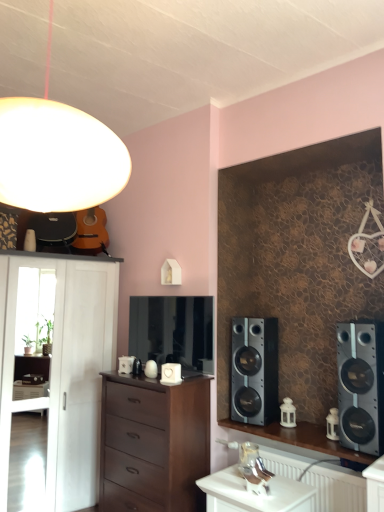
Question: Is matte white globe at upper left at the left side of satin silver speaker at right, placed as the first speaker when sorted from back to front?

Choices:
 (A) no
 (B) yes

Answer: (B)

Question: Is matte white globe at upper left facing towards satin silver speaker at right, acting as the second speaker starting from the right?

Choices:
 (A) no
 (B) yes

Answer: (A)

Question: Can you confirm if matte white globe at upper left is shorter than satin silver speaker at right, acting as the second speaker starting from the right?

Choices:
 (A) no
 (B) yes

Answer: (A)

Question: Is matte white globe at upper left wider than satin silver speaker at right, arranged as the second speaker when viewed from the front?

Choices:
 (A) yes
 (B) no

Answer: (A)

Question: From the image's perspective, is matte white globe at upper left above satin silver speaker at right, acting as the second speaker starting from the right?

Choices:
 (A) no
 (B) yes

Answer: (B)

Question: Looking at the image, does white porcelain lantern at center seem bigger or smaller compared to matte white globe at upper left?

Choices:
 (A) small
 (B) big

Answer: (A)

Question: From their relative heights in the image, would you say white porcelain lantern at center is taller or shorter than matte white globe at upper left?

Choices:
 (A) short
 (B) tall

Answer: (A)

Question: From a real-world perspective, is white porcelain lantern at center positioned above or below matte white globe at upper left?

Choices:
 (A) above
 (B) below

Answer: (B)

Question: Does point (291, 402) appear closer or farther from the camera than point (49, 35)?

Choices:
 (A) closer
 (B) farther

Answer: (B)

Question: From a real-world perspective, is brown wood chest of drawers at center physically located above or below satin silver speaker at right, positioned as the 2th speaker in back-to-front order?

Choices:
 (A) below
 (B) above

Answer: (A)

Question: From their relative heights in the image, would you say brown wood chest of drawers at center is taller or shorter than satin silver speaker at right, positioned as the first speaker in front-to-back order?

Choices:
 (A) tall
 (B) short

Answer: (A)

Question: Is point (122, 425) positioned closer to the camera than point (357, 374)?

Choices:
 (A) farther
 (B) closer

Answer: (A)

Question: Looking at their shapes, would you say brown wood chest of drawers at center is wider or thinner than satin silver speaker at right, acting as the first speaker starting from the right?

Choices:
 (A) wide
 (B) thin

Answer: (A)

Question: Is satin silver speaker at right, acting as the second speaker starting from the right, bigger or smaller than white matte cabinet at left?

Choices:
 (A) big
 (B) small

Answer: (B)

Question: Is satin silver speaker at right, which appears as the 1th speaker when viewed from the left, wider or thinner than white matte cabinet at left?

Choices:
 (A) wide
 (B) thin

Answer: (B)